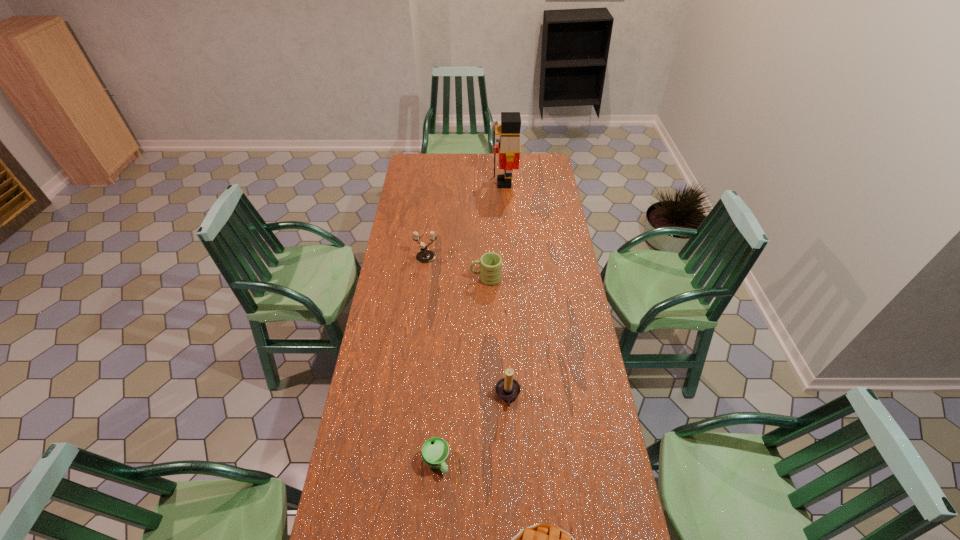
Where is `vacant area that lies between the third nearest object and the nutcracker`? vacant area that lies between the third nearest object and the nutcracker is located at coordinates coord(506,289).

What are the coordinates of `free point between the right candle holder and the mug` in the screenshot? It's located at (497, 337).

You are a GUI agent. You are given a task and a screenshot of the screen. Output one action in this format:
    pyautogui.click(x=<x>, y=<y>)
    Task: Click on the free point between the mug and the tallest object
    The image size is (960, 540).
    Given the screenshot: What is the action you would take?
    pyautogui.click(x=495, y=231)

At what (x,y) coordinates should I click in order to perform the action: click on vacant area between the farther candle holder and the farthest object. Please return your answer as a coordinate pair (x, y). The height and width of the screenshot is (540, 960). Looking at the image, I should click on (465, 220).

The height and width of the screenshot is (540, 960). In order to click on object that is the fourth closest one to the third farthest object in this screenshot , I will do `click(435, 451)`.

Where is `object that is the closest to the second object from left to right`? object that is the closest to the second object from left to right is located at coordinates (507, 388).